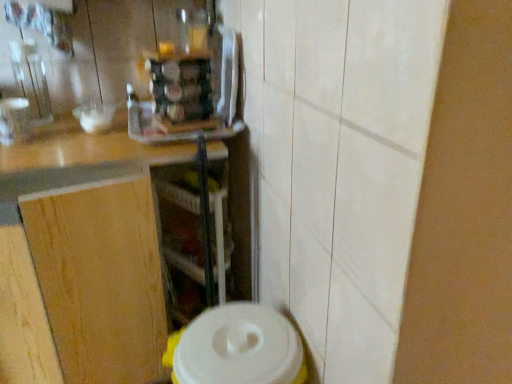
Question: Is wooden at left wider or thinner than transparent plastic shelf at center?

Choices:
 (A) wide
 (B) thin

Answer: (A)

Question: Does point (181, 147) appear closer or farther from the camera than point (198, 240)?

Choices:
 (A) closer
 (B) farther

Answer: (A)

Question: Estimate the real-world distances between objects in this image. Which object is closer to the white plastic container at lower center?

Choices:
 (A) wooden at left
 (B) transparent plastic shelf at center

Answer: (A)

Question: Considering the real-world distances, which object is closest to the wooden at left?

Choices:
 (A) transparent plastic shelf at center
 (B) white plastic container at lower center

Answer: (A)